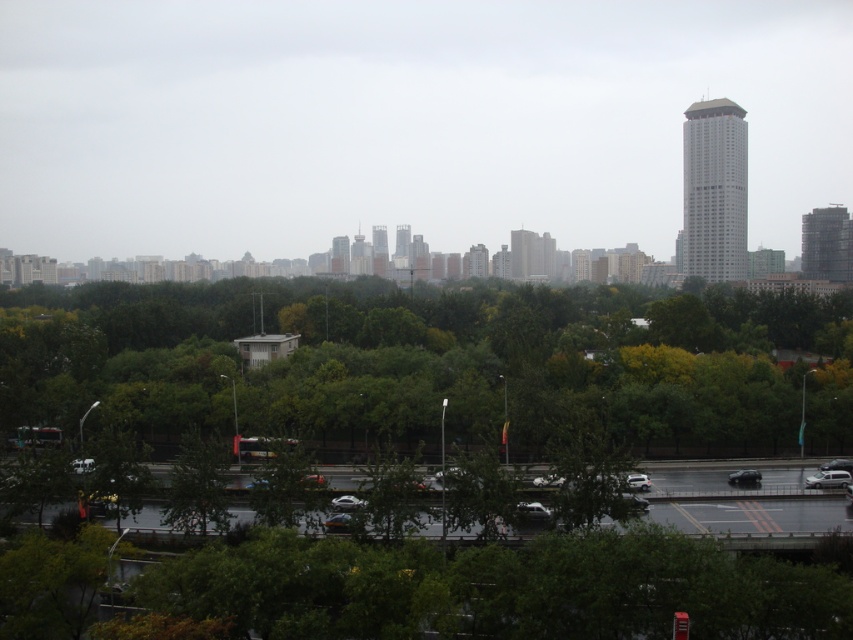
Question: Which point appears farthest from the camera in this image?

Choices:
 (A) (660, 170)
 (B) (141, 289)

Answer: (A)

Question: Is transparent glass skyscraper at center positioned in front of green leafy trees at center?

Choices:
 (A) no
 (B) yes

Answer: (A)

Question: Is transparent glass skyscraper at center to the right of green leafy trees at center from the viewer's perspective?

Choices:
 (A) no
 (B) yes

Answer: (A)

Question: Which of the following is the farthest from the observer?

Choices:
 (A) transparent glass skyscraper at center
 (B) green leafy trees at center

Answer: (A)

Question: Is transparent glass skyscraper at center in front of green leafy trees at center?

Choices:
 (A) yes
 (B) no

Answer: (B)